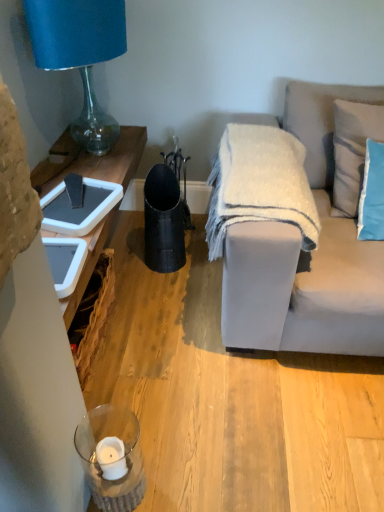
Question: Is blue glass lamp at upper left directly adjacent to white fuzzy blanket at center?

Choices:
 (A) no
 (B) yes

Answer: (A)

Question: Is white fuzzy blanket at center at the back of blue glass lamp at upper left?

Choices:
 (A) no
 (B) yes

Answer: (A)

Question: Is blue glass lamp at upper left in front of white fuzzy blanket at center?

Choices:
 (A) no
 (B) yes

Answer: (A)

Question: Considering the relative sizes of blue glass lamp at upper left and white fuzzy blanket at center in the image provided, is blue glass lamp at upper left wider than white fuzzy blanket at center?

Choices:
 (A) yes
 (B) no

Answer: (B)

Question: From the image's perspective, is blue glass lamp at upper left under white fuzzy blanket at center?

Choices:
 (A) yes
 (B) no

Answer: (B)

Question: From the image's perspective, is blue glass lamp at upper left located above or below light gray fabric pillow at upper right, which is counted as the 2th pillow, starting from the bottom?

Choices:
 (A) above
 (B) below

Answer: (A)

Question: In terms of height, does blue glass lamp at upper left look taller or shorter compared to light gray fabric pillow at upper right, marked as the 1th pillow in a top-to-bottom arrangement?

Choices:
 (A) tall
 (B) short

Answer: (A)

Question: Based on their sizes in the image, would you say blue glass lamp at upper left is bigger or smaller than light gray fabric pillow at upper right, which is counted as the 2th pillow, starting from the bottom?

Choices:
 (A) small
 (B) big

Answer: (B)

Question: Which is correct: blue glass lamp at upper left is inside light gray fabric pillow at upper right, marked as the 1th pillow in a top-to-bottom arrangement, or outside of it?

Choices:
 (A) inside
 (B) outside

Answer: (B)

Question: Is light gray fabric pillow at upper right, which is counted as the 2th pillow, starting from the bottom, taller or shorter than blue glass lamp at upper left?

Choices:
 (A) short
 (B) tall

Answer: (A)

Question: Is light gray fabric pillow at upper right, which is counted as the 2th pillow, starting from the bottom, in front of or behind blue glass lamp at upper left in the image?

Choices:
 (A) front
 (B) behind

Answer: (B)

Question: Is point (299, 105) positioned closer to the camera than point (41, 42)?

Choices:
 (A) closer
 (B) farther

Answer: (B)

Question: From a real-world perspective, is light gray fabric pillow at upper right, marked as the 1th pillow in a top-to-bottom arrangement, positioned above or below blue glass lamp at upper left?

Choices:
 (A) below
 (B) above

Answer: (A)

Question: Would you say light gray fabric couch at right is to the left or to the right of blue fabric pillow at upper right, the 1th pillow positioned from the bottom, in the picture?

Choices:
 (A) left
 (B) right

Answer: (A)

Question: Is light gray fabric couch at right wider or thinner than blue fabric pillow at upper right, marked as the second pillow in a top-to-bottom arrangement?

Choices:
 (A) thin
 (B) wide

Answer: (B)